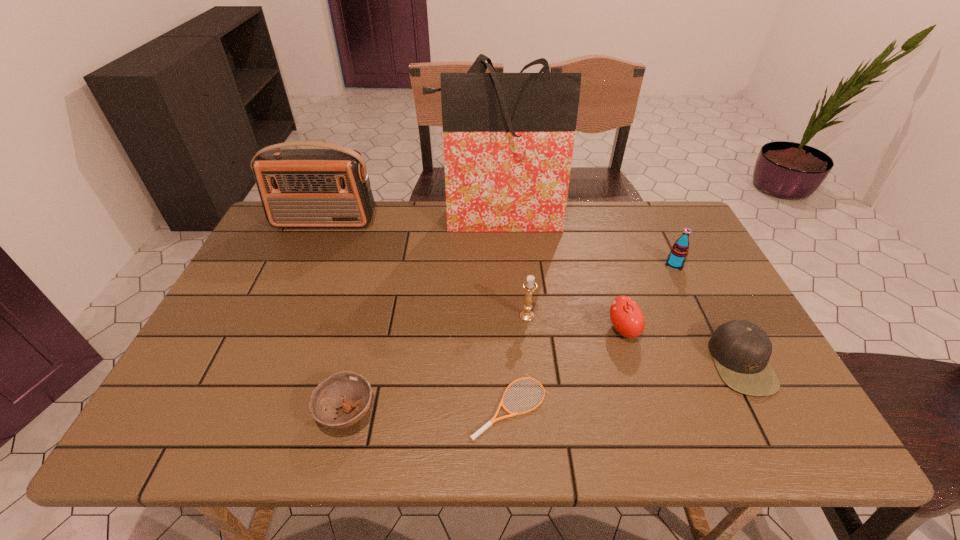
The width and height of the screenshot is (960, 540). I want to click on vacant area situated 0.050m on the front-facing side of the radio receiver, so click(316, 241).

Image resolution: width=960 pixels, height=540 pixels. I want to click on vacant region located 0.350m on the left of the candle holder, so click(x=386, y=316).

Locate an element on the screen. The width and height of the screenshot is (960, 540). vacant area situated 0.080m on the right of the soda is located at coordinates (712, 264).

This screenshot has height=540, width=960. Identify the location of vacant space located on the back of the apple. (598, 249).

The image size is (960, 540). Find the location of `vacant area situated 0.160m on the brim of the third shortest object`. vacant area situated 0.160m on the brim of the third shortest object is located at coordinates (646, 363).

The image size is (960, 540). Find the location of `vacant region located 0.230m on the brim of the third shortest object`. vacant region located 0.230m on the brim of the third shortest object is located at coordinates (616, 363).

The image size is (960, 540). Find the location of `blank space located 0.120m on the brim of the third shortest object`. blank space located 0.120m on the brim of the third shortest object is located at coordinates (662, 363).

Where is `vacant space situated on the left of the bowl`? vacant space situated on the left of the bowl is located at coordinates (160, 413).

Find the location of a particular element. The image size is (960, 540). vacant space located on the back of the shortest object is located at coordinates (504, 285).

Locate an element on the screen. The image size is (960, 540). shopping bag that is at the far edge is located at coordinates (508, 138).